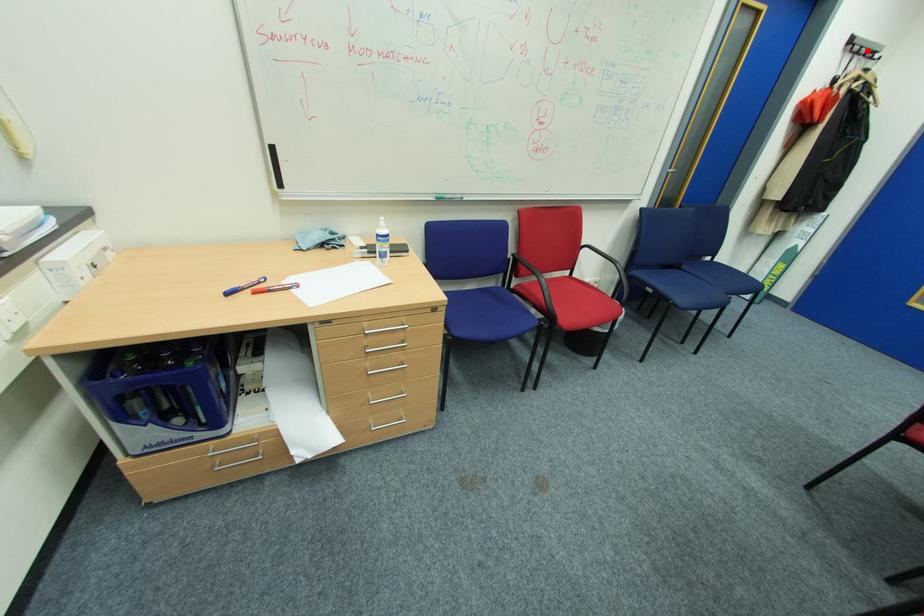
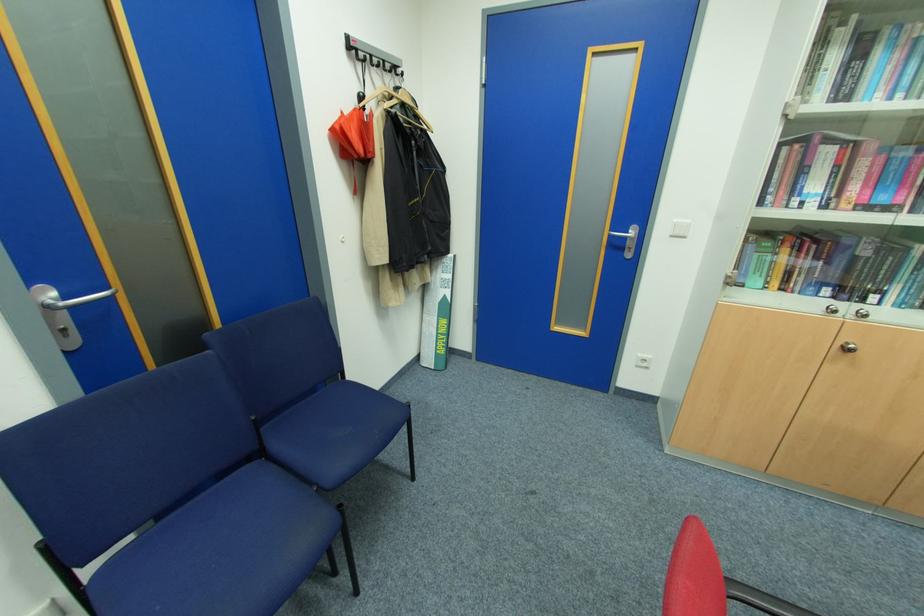
Question: I am providing you with two images of the same scene from different viewpoints. Given a red point in image1, look at the same physical point in image2. Is it:

Choices:
 (A) Closer to the viewpoint
 (B) Farther from the viewpoint

Answer: (A)